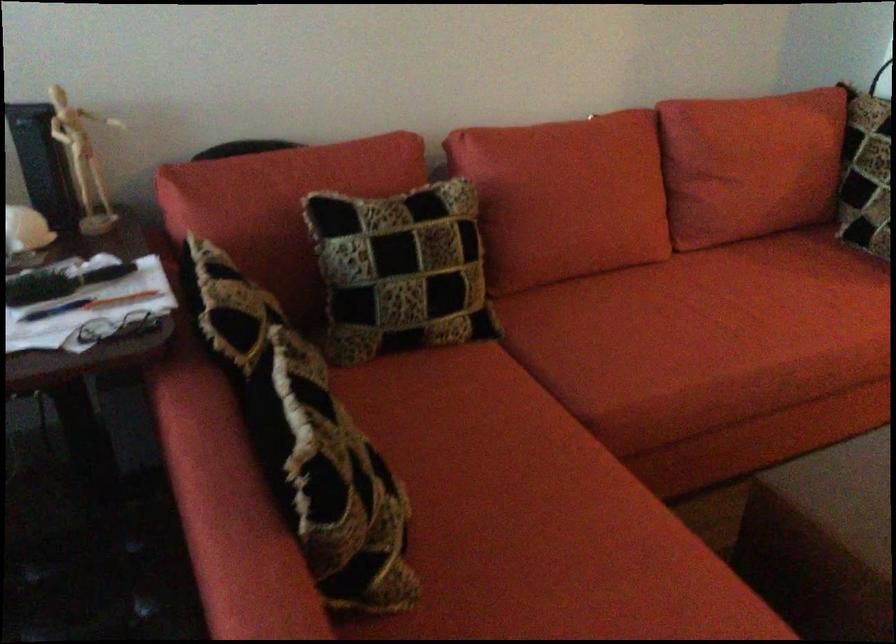
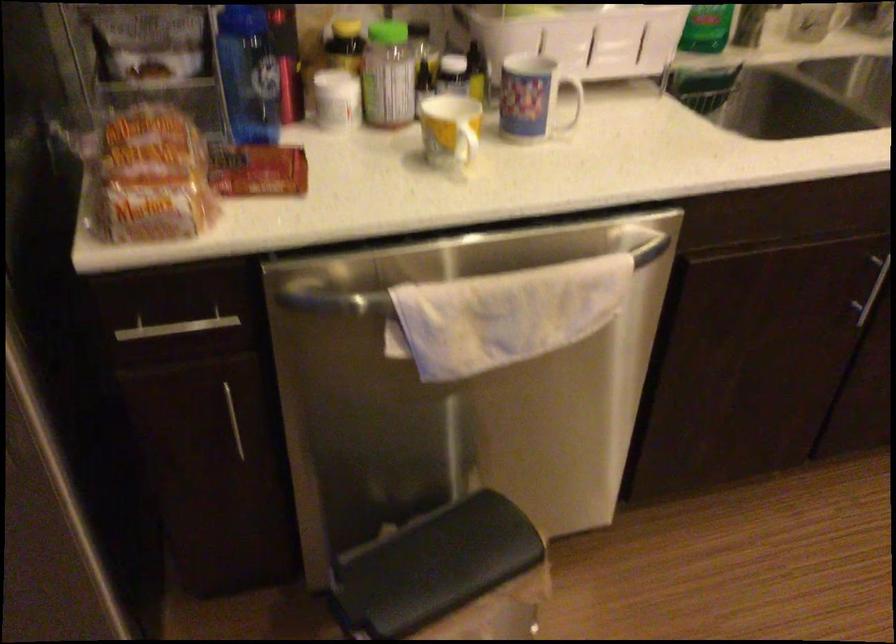
Which direction would the cameraman need to move to produce the second image?

The cameraman moved toward right, forward.